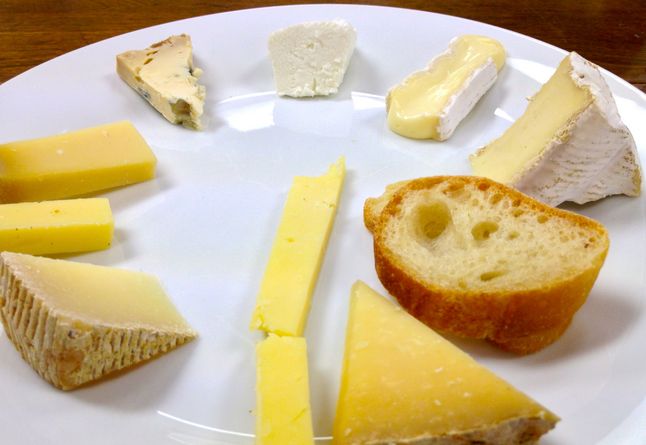
Where is `plate`? plate is located at coordinates (231, 189).